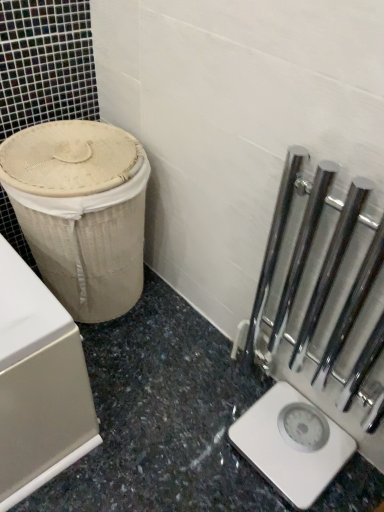
Question: Considering the positions of beige woven basket at left and polished chrome rail at right in the image, is beige woven basket at left bigger or smaller than polished chrome rail at right?

Choices:
 (A) small
 (B) big

Answer: (B)

Question: Considering their positions, is beige woven basket at left located in front of or behind polished chrome rail at right?

Choices:
 (A) behind
 (B) front

Answer: (A)

Question: Considering the real-world distances, which object is closest to the white plastic scale at lower right?

Choices:
 (A) beige woven basket at left
 (B) polished chrome rail at right

Answer: (B)

Question: Which object is the closest to the white plastic scale at lower right?

Choices:
 (A) polished chrome rail at right
 (B) beige woven basket at left

Answer: (A)